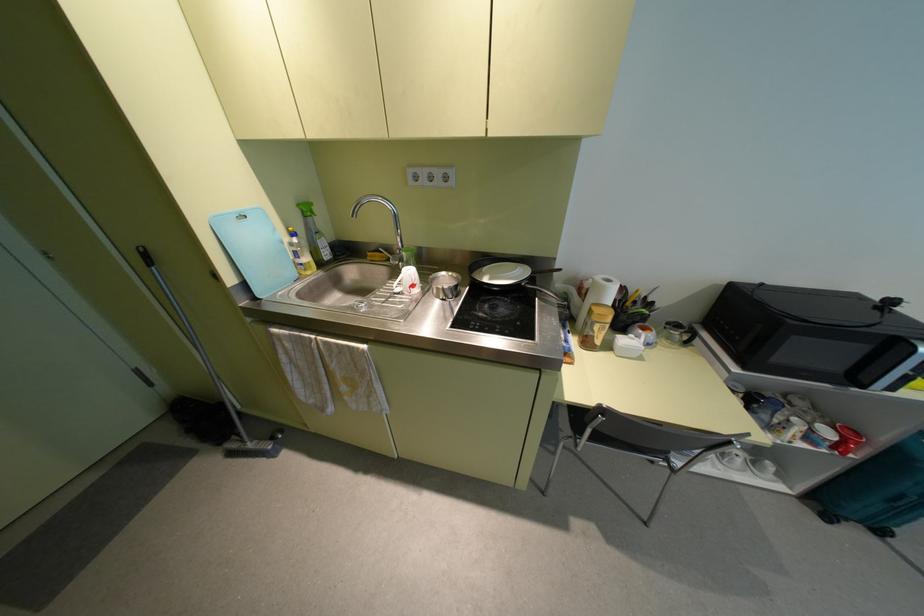
Identify the location of white lidded container. The width and height of the screenshot is (924, 616). (626, 346).